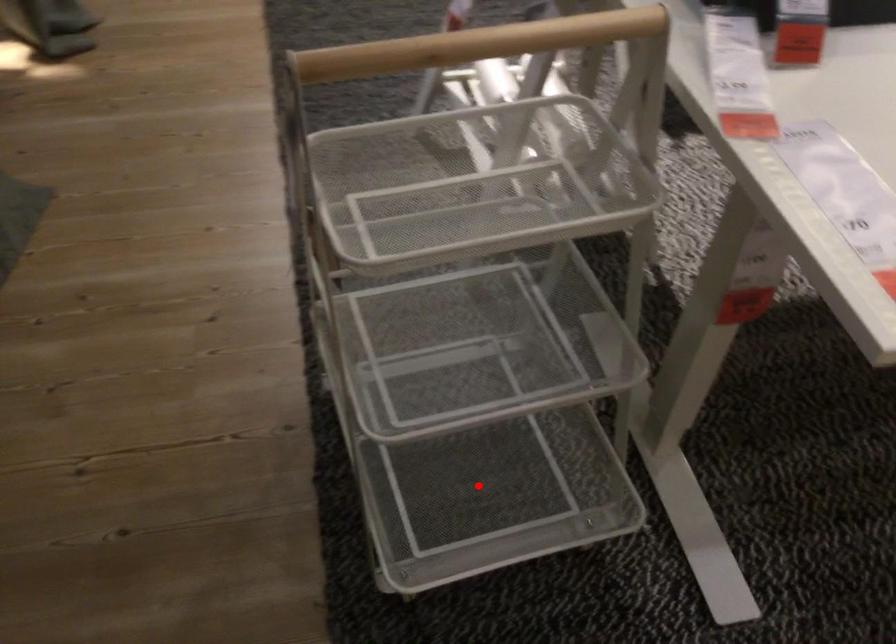
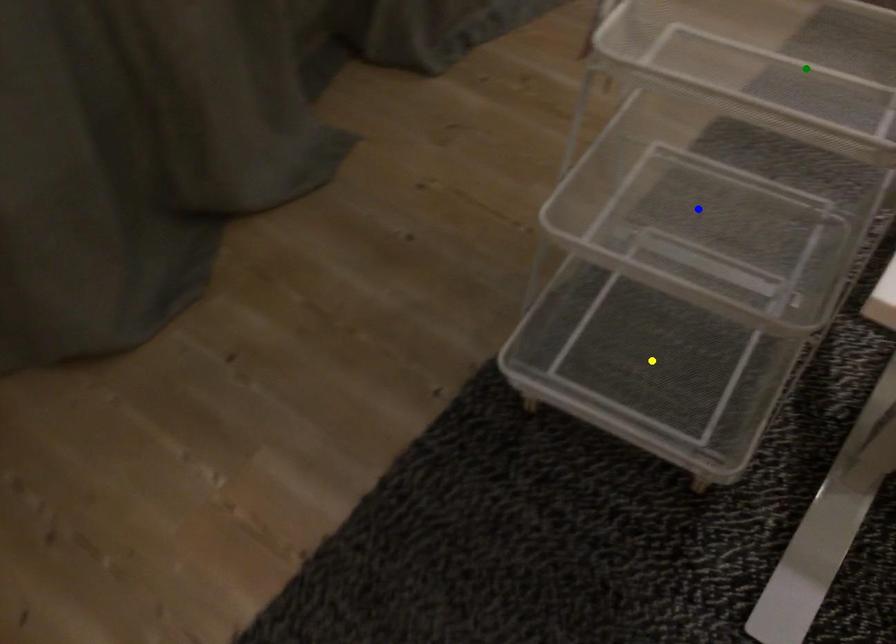
Question: I am providing you with two images of the same scene from different viewpoints. A red point is marked on the first image. You are given multiple points on the second image. Which spot in image 2 lines up with the point in image 1?

Choices:
 (A) blue point
 (B) yellow point
 (C) green point

Answer: (B)